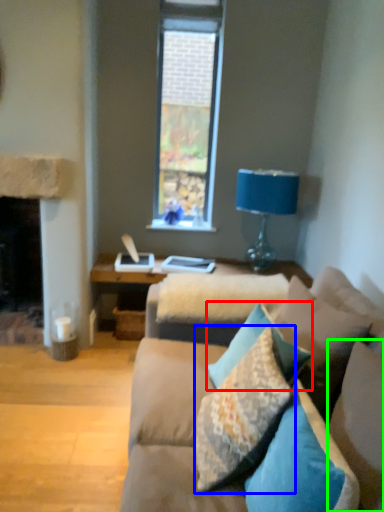
Question: Which is farther away from pillow (highlighted by a red box)? pillow (highlighted by a blue box) or pillow (highlighted by a green box)?

Choices:
 (A) pillow
 (B) pillow

Answer: (B)